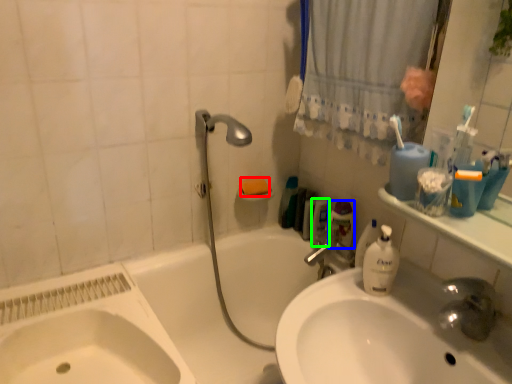
Question: Which object is the closest to the soap (highlighted by a red box)? Choose among these: toiletry (highlighted by a blue box) or mouthwash (highlighted by a green box).

Choices:
 (A) toiletry
 (B) mouthwash

Answer: (B)